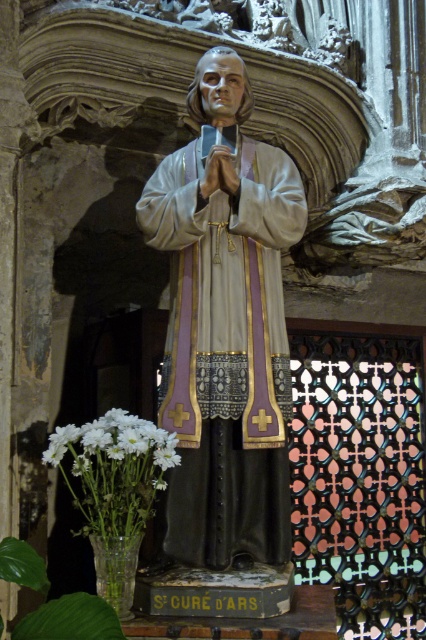
Question: Which point appears closest to the camera in this image?

Choices:
 (A) (141, 440)
 (B) (192, 108)

Answer: (A)

Question: Is matte wood statue at center bigger than white matte flowers at lower left?

Choices:
 (A) yes
 (B) no

Answer: (A)

Question: Which point is closer to the camera taking this photo?

Choices:
 (A) (285, 497)
 (B) (123, 417)

Answer: (B)

Question: Does matte wood statue at center have a smaller size compared to white matte flowers at lower left?

Choices:
 (A) yes
 (B) no

Answer: (B)

Question: Is matte wood statue at center to the right of white matte flowers at lower left from the viewer's perspective?

Choices:
 (A) no
 (B) yes

Answer: (B)